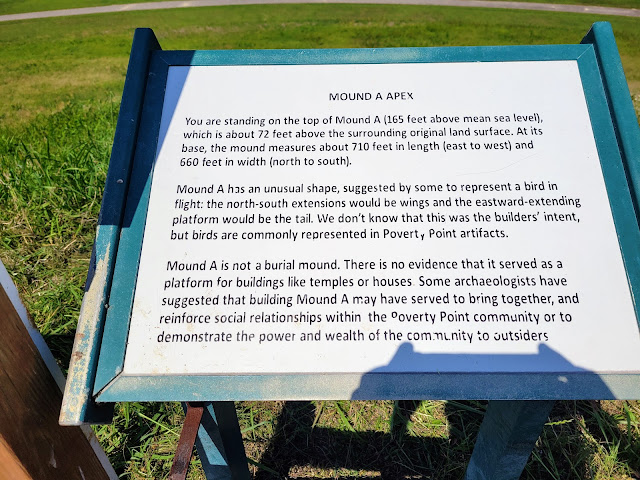
Locate an element on the screen. This screenshot has width=640, height=480. plaque is located at coordinates (211, 91).